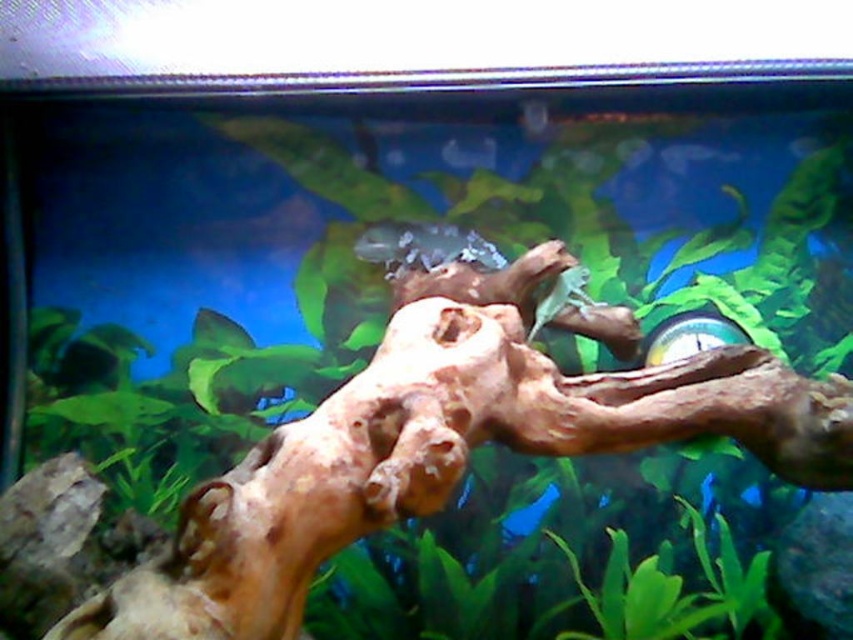
Does point (399, 264) come closer to viewer compared to point (469, 168)?

Yes, it is.

Based on the photo, can you confirm if translucent glass fish at center is positioned below translucent plastic fish at center?

Correct, translucent glass fish at center is located below translucent plastic fish at center.

What are the coordinates of `translucent glass fish at center` in the screenshot? It's located at (424, 244).